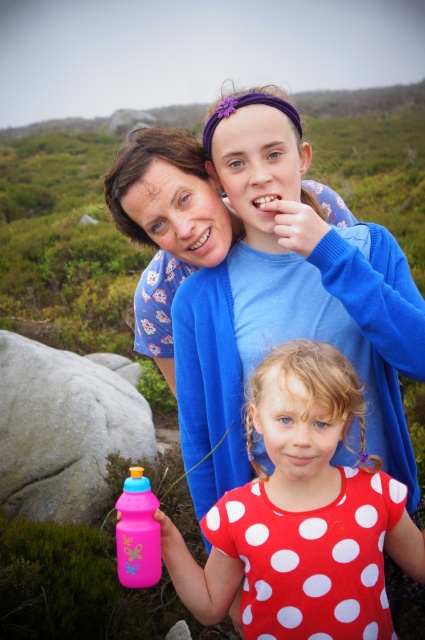
Question: Which of the following is the closest to the observer?

Choices:
 (A) (99, 372)
 (B) (218, 525)
 (C) (127, 496)

Answer: (C)

Question: Is pink plastic water bottle at center smaller than pink plastic bottle at lower left?

Choices:
 (A) yes
 (B) no

Answer: (B)

Question: Considering the real-world distances, which object is farthest from the pink plastic bottle at lower left?

Choices:
 (A) gray rough rock at lower left
 (B) pink plastic water bottle at center

Answer: (A)

Question: Which of the following is the closest to the observer?

Choices:
 (A) gray rough rock at lower left
 (B) pink plastic water bottle at center

Answer: (B)

Question: Observing the image, what is the correct spatial positioning of gray rough rock at lower left in reference to pink plastic bottle at lower left?

Choices:
 (A) below
 (B) above

Answer: (A)

Question: Where is pink plastic water bottle at center located in relation to pink plastic bottle at lower left in the image?

Choices:
 (A) left
 (B) right

Answer: (B)